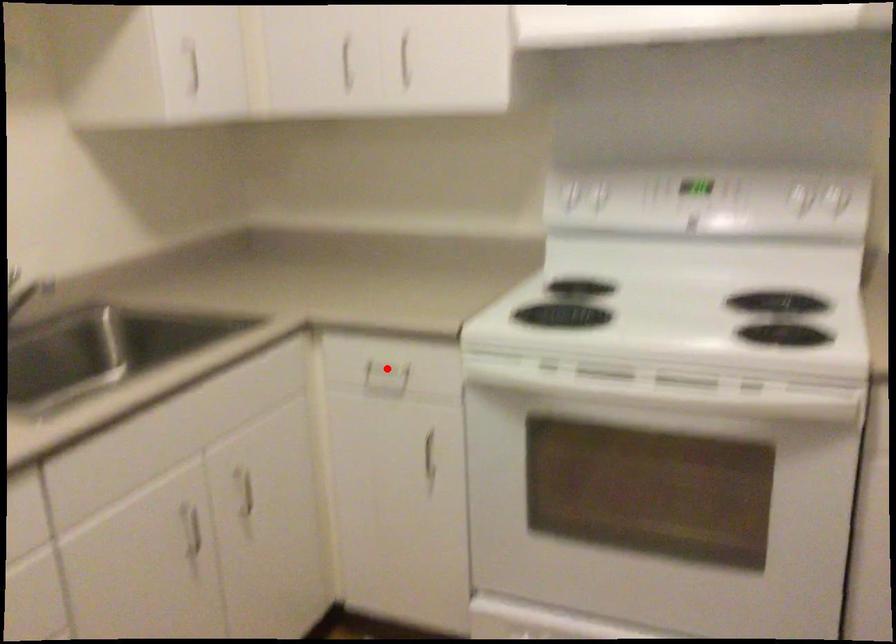
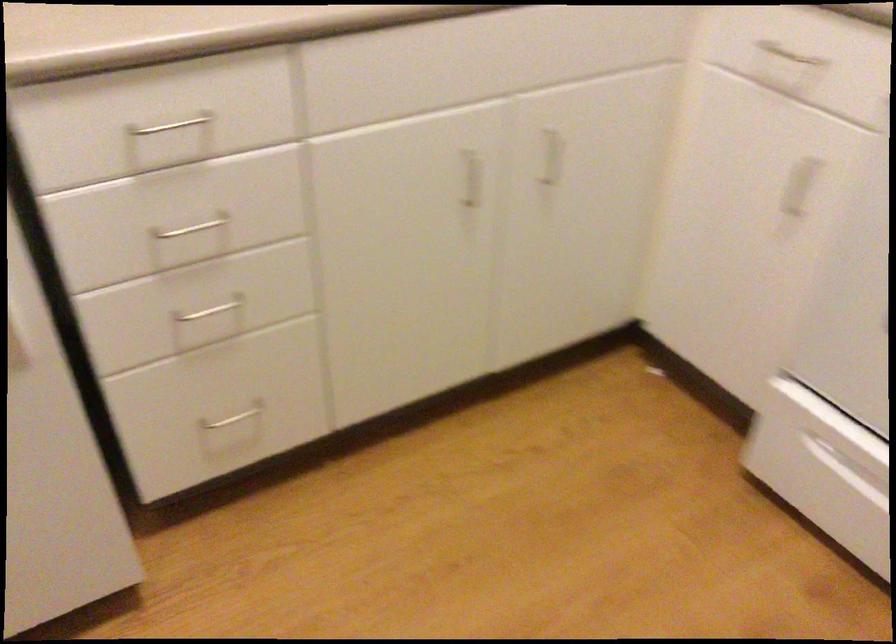
Question: I am providing you with two images of the same scene from different viewpoints. A red point is shown in image1. For the corresponding object point in image2, is it positioned nearer or farther from the camera?

Choices:
 (A) Nearer
 (B) Farther

Answer: (A)